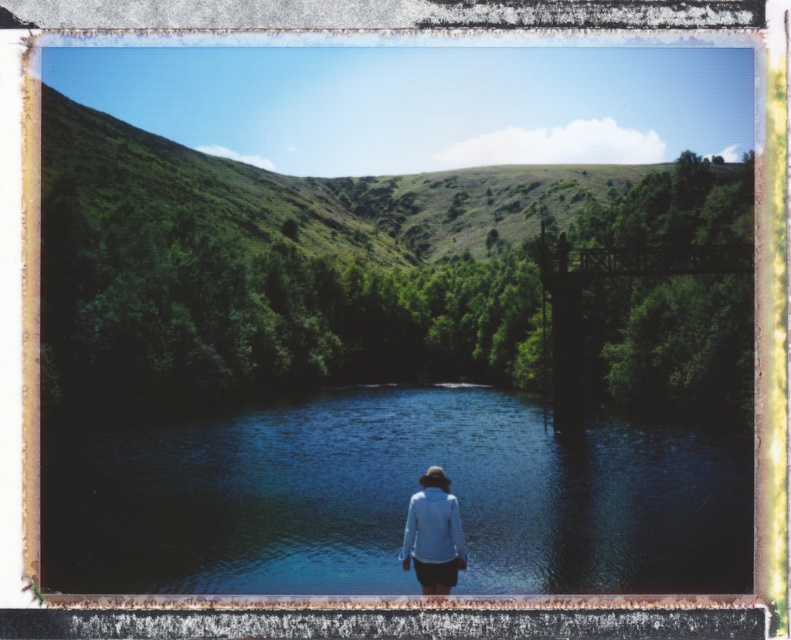
Question: Considering the relative positions of green grassy hillside at upper center and blue reflective water at center in the image provided, where is green grassy hillside at upper center located with respect to blue reflective water at center?

Choices:
 (A) above
 (B) below

Answer: (A)

Question: Is green grassy hillside at upper center positioned before blue reflective water at center?

Choices:
 (A) yes
 (B) no

Answer: (B)

Question: Is green grassy hillside at upper center above blue reflective water at center?

Choices:
 (A) no
 (B) yes

Answer: (B)

Question: Which of the following is the farthest from the observer?

Choices:
 (A) green grassy hillside at upper center
 (B) blue reflective water at center

Answer: (A)

Question: Among these objects, which one is farthest from the camera?

Choices:
 (A) blue reflective water at center
 (B) green grassy hillside at upper center

Answer: (B)